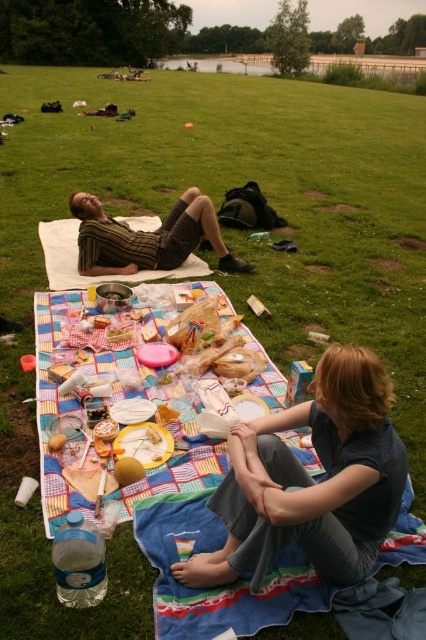
Question: Can you confirm if denim jeans at lower right is bigger than striped fabric shirt at upper left?

Choices:
 (A) yes
 (B) no

Answer: (B)

Question: Is denim jeans at lower right closer to camera compared to striped fabric shirt at upper left?

Choices:
 (A) no
 (B) yes

Answer: (B)

Question: Among these points, which one is farthest from the camera?

Choices:
 (A) (239, 424)
 (B) (101, 225)

Answer: (B)

Question: Which of the following is the closest to the observer?

Choices:
 (A) (322, 372)
 (B) (192, 220)

Answer: (A)

Question: Is denim jeans at lower right to the right of striped fabric shirt at upper left from the viewer's perspective?

Choices:
 (A) yes
 (B) no

Answer: (A)